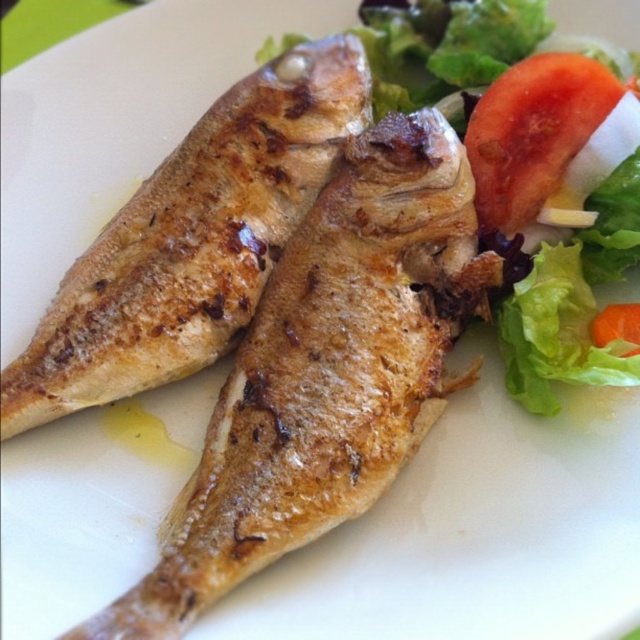
Is point (456, 52) farther from camera compared to point (624, 320)?

Yes, point (456, 52) is farther from viewer.

Is point (547, 381) positioned after point (595, 317)?

No, (547, 381) is closer to viewer.

Where is `green leafy salad at upper right`? This screenshot has width=640, height=640. green leafy salad at upper right is located at coordinates (529, 164).

Is golden-brown crispy fish at center thinner than brown crispy fish at center?

No, golden-brown crispy fish at center is not thinner than brown crispy fish at center.

Which is more to the right, golden-brown crispy fish at center or brown crispy fish at center?

golden-brown crispy fish at center is more to the right.

Is point (387, 212) behind point (140, 339)?

Yes, it is.

Where is `golden-brown crispy fish at center`? The width and height of the screenshot is (640, 640). golden-brown crispy fish at center is located at coordinates (324, 372).

Does brown crispy fish at center come behind red matte tomato at upper right?

No, it is not.

Is brown crispy fish at center below red matte tomato at upper right?

Yes, brown crispy fish at center is below red matte tomato at upper right.

Find the location of `brown crispy fish at center`. brown crispy fish at center is located at coordinates (193, 240).